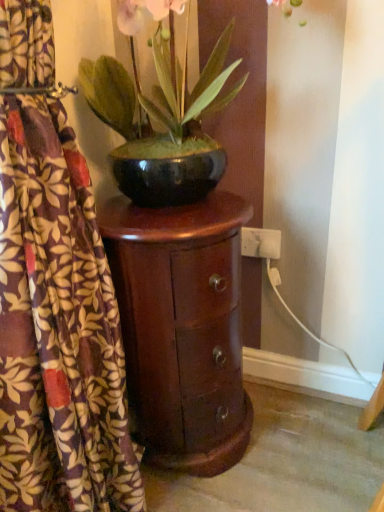
Question: From the image's perspective, is glossy wood nightstand at left below green glossy bowl at center?

Choices:
 (A) no
 (B) yes

Answer: (B)

Question: Is glossy wood nightstand at left turned away from green glossy bowl at center?

Choices:
 (A) no
 (B) yes

Answer: (A)

Question: Is glossy wood nightstand at left not inside green glossy bowl at center?

Choices:
 (A) no
 (B) yes

Answer: (B)

Question: From a real-world perspective, is glossy wood nightstand at left located beneath green glossy bowl at center?

Choices:
 (A) yes
 (B) no

Answer: (A)

Question: Considering the relative sizes of glossy wood nightstand at left and green glossy bowl at center in the image provided, is glossy wood nightstand at left taller than green glossy bowl at center?

Choices:
 (A) yes
 (B) no

Answer: (A)

Question: From the image's perspective, is white plastic electric outlet at lower right above or below glossy wood nightstand at left?

Choices:
 (A) above
 (B) below

Answer: (A)

Question: Is white plastic electric outlet at lower right bigger or smaller than glossy wood nightstand at left?

Choices:
 (A) small
 (B) big

Answer: (A)

Question: Do you think white plastic electric outlet at lower right is within glossy wood nightstand at left, or outside of it?

Choices:
 (A) outside
 (B) inside

Answer: (A)

Question: From a real-world perspective, is white plastic electric outlet at lower right physically located above or below glossy wood nightstand at left?

Choices:
 (A) above
 (B) below

Answer: (A)

Question: In terms of width, does printed fabric curtain at left look wider or thinner when compared to green glossy bowl at center?

Choices:
 (A) wide
 (B) thin

Answer: (B)

Question: Considering the positions of printed fabric curtain at left and green glossy bowl at center in the image, is printed fabric curtain at left bigger or smaller than green glossy bowl at center?

Choices:
 (A) small
 (B) big

Answer: (B)

Question: From the image's perspective, is printed fabric curtain at left positioned above or below green glossy bowl at center?

Choices:
 (A) above
 (B) below

Answer: (B)

Question: From a real-world perspective, is printed fabric curtain at left above or below green glossy bowl at center?

Choices:
 (A) below
 (B) above

Answer: (A)

Question: Visually, is printed fabric curtain at left positioned to the left or to the right of glossy wood nightstand at left?

Choices:
 (A) left
 (B) right

Answer: (A)

Question: Is printed fabric curtain at left taller or shorter than glossy wood nightstand at left?

Choices:
 (A) short
 (B) tall

Answer: (B)